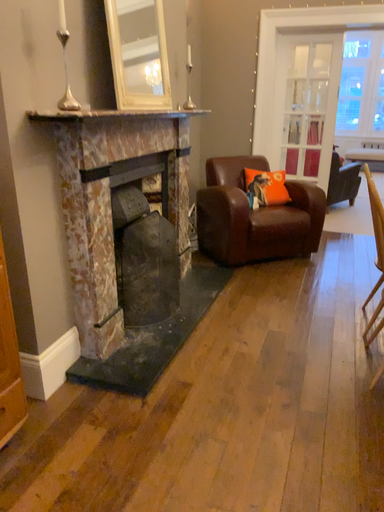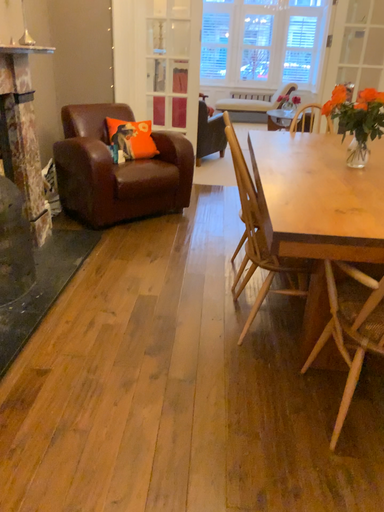
Question: How did the camera likely rotate when shooting the video?

Choices:
 (A) rotated left
 (B) rotated right

Answer: (B)